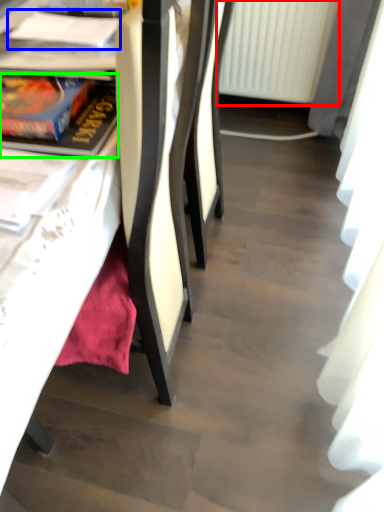
Question: Based on their relative distances, which object is farther from radiator (highlighted by a red box)? Choose from book (highlighted by a blue box) and book (highlighted by a green box).

Choices:
 (A) book
 (B) book

Answer: (B)